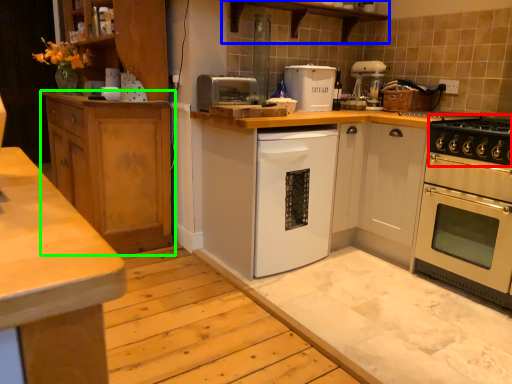
Question: Which object is positioned farthest from gas stove (highlighted by a red box)? Select from shelf (highlighted by a blue box) and cabinetry (highlighted by a green box).

Choices:
 (A) shelf
 (B) cabinetry

Answer: (B)